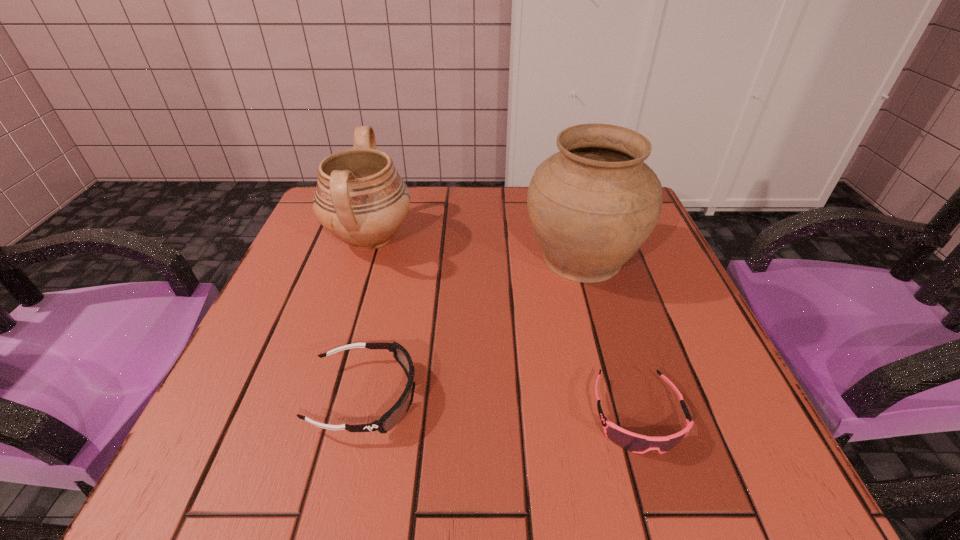
The width and height of the screenshot is (960, 540). Find the location of `free spot at the near edge of the desktop`. free spot at the near edge of the desktop is located at coordinates (428, 449).

You are a GUI agent. You are given a task and a screenshot of the screen. Output one action in this format:
    pyautogui.click(x=<x>, y=<y>)
    Task: Click on the vacant space at the left edge of the desktop
    Image resolution: width=960 pixels, height=540 pixels.
    Given the screenshot: What is the action you would take?
    pyautogui.click(x=287, y=305)

At what (x,y) coordinates should I click in order to perform the action: click on vacant space at the right edge of the desktop. Please return your answer as a coordinate pair (x, y). The width and height of the screenshot is (960, 540). Looking at the image, I should click on (655, 302).

Image resolution: width=960 pixels, height=540 pixels. In order to click on free space at the near left corner in this screenshot , I will do `click(259, 428)`.

Find the location of `unoccupied area between the left urn and the left goggles`. unoccupied area between the left urn and the left goggles is located at coordinates (368, 317).

At what (x,y) coordinates should I click in order to perform the action: click on vacant space in between the shortest object and the taller urn. Please return your answer as a coordinate pair (x, y). Looking at the image, I should click on (610, 336).

The width and height of the screenshot is (960, 540). Find the location of `free area in between the left urn and the taller goggles`. free area in between the left urn and the taller goggles is located at coordinates (368, 317).

I want to click on free area in between the second shortest object and the tallest object, so [x=473, y=327].

Where is `vacant space that is in between the left goggles and the shorter goggles`? The image size is (960, 540). vacant space that is in between the left goggles and the shorter goggles is located at coordinates (501, 406).

Identify the location of vacant area that lies between the tallest object and the second shortest object. (473, 327).